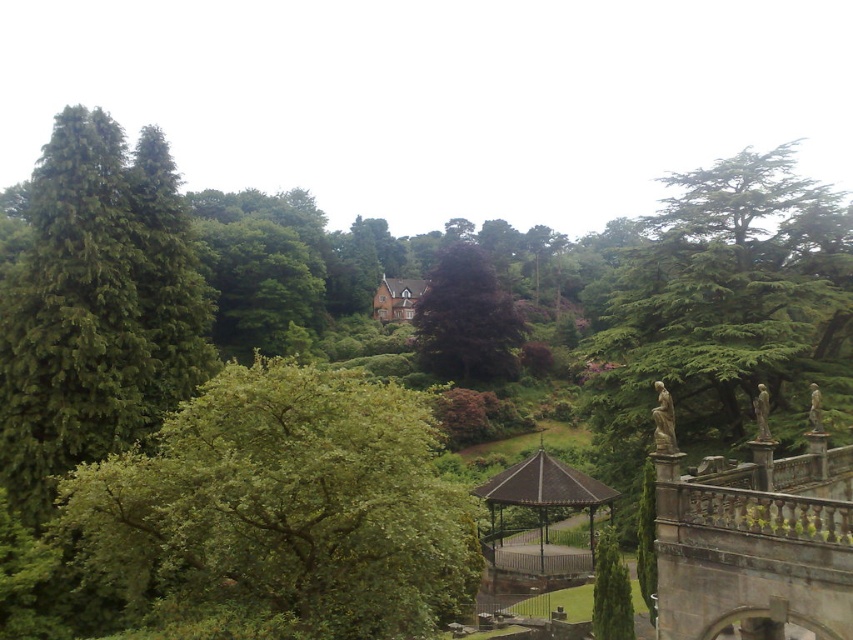
Question: From the image, what is the correct spatial relationship of green leafy tree at center in relation to metallic gazebo at center?

Choices:
 (A) right
 (B) left

Answer: (B)

Question: Based on their relative distances, which object is nearer to the metallic gazebo at center?

Choices:
 (A) green leafy tree at center
 (B) dark purple leafy tree at center

Answer: (A)

Question: Can you confirm if green leafy tree at center is smaller than dark purple leafy tree at center?

Choices:
 (A) no
 (B) yes

Answer: (B)

Question: Is dark purple leafy tree at center positioned in front of metallic gazebo at center?

Choices:
 (A) no
 (B) yes

Answer: (A)

Question: Among these points, which one is farthest from the camera?

Choices:
 (A) (461, 369)
 (B) (550, 472)
 (C) (68, 474)

Answer: (A)

Question: Which of the following is the farthest from the observer?

Choices:
 (A) (x=524, y=461)
 (B) (x=454, y=262)

Answer: (B)